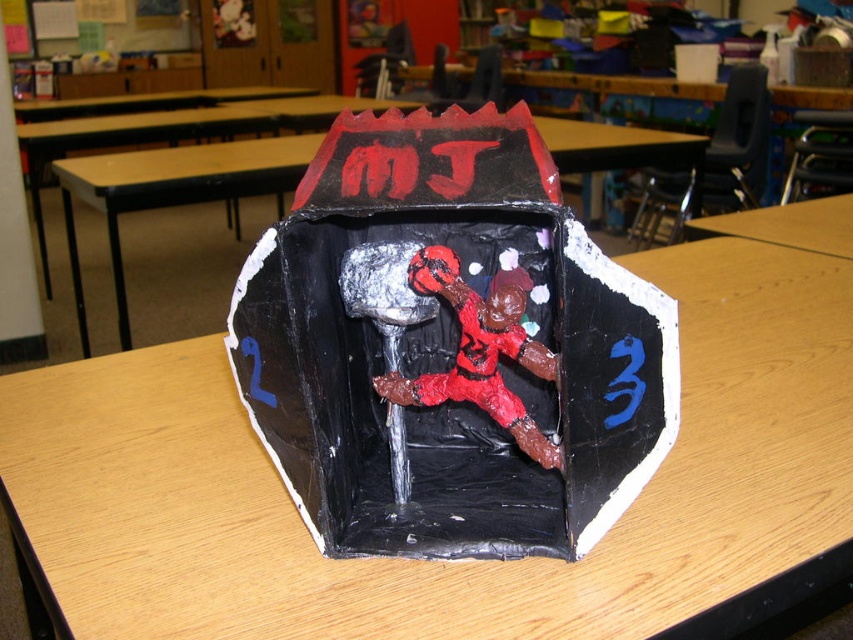
Who is taller, wooden table at center or matte black figurine at center?

matte black figurine at center

Which is in front, point (462, 598) or point (548, 252)?

Point (462, 598) is in front.

Does point (135, 445) come in front of point (310, 384)?

No, (135, 445) is behind (310, 384).

Find the location of a particular element. wooden table at center is located at coordinates (440, 563).

Measure the distance from wooden table at center to black cardboard box at center.

3.70 feet

The image size is (853, 640). What do you see at coordinates (440, 563) in the screenshot? I see `wooden table at center` at bounding box center [440, 563].

Find the location of a particular element. The width and height of the screenshot is (853, 640). wooden table at center is located at coordinates (440, 563).

Is matte black figurine at center bigger than black cardboard box at center?

Actually, matte black figurine at center might be smaller than black cardboard box at center.

Between point (643, 291) and point (70, 225), which one is positioned in front?

Positioned in front is point (643, 291).

Image resolution: width=853 pixels, height=640 pixels. I want to click on matte black figurine at center, so click(450, 346).